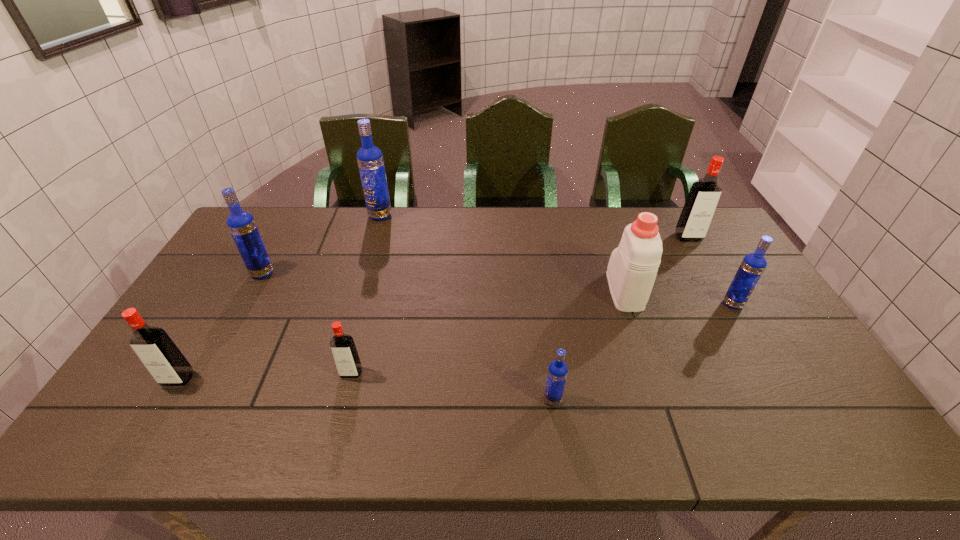
You are a GUI agent. You are given a task and a screenshot of the screen. Output one action in this format:
    pyautogui.click(x=<x>, y=<y>)
    Task: Click on the leftmost red vodka
    The height and width of the screenshot is (540, 960).
    Given the screenshot: What is the action you would take?
    pyautogui.click(x=168, y=366)

Locate an element on the screen. This screenshot has height=540, width=960. the third vodka from right to left is located at coordinates (x=557, y=372).

Find the location of a particular element. Image resolution: width=960 pixels, height=540 pixels. the nearest object is located at coordinates (557, 372).

Where is `the second red vodka from right to left`? Image resolution: width=960 pixels, height=540 pixels. the second red vodka from right to left is located at coordinates (345, 355).

Locate an element on the screen. Image resolution: width=960 pixels, height=540 pixels. vacant space located on the left of the tallest vodka is located at coordinates (320, 215).

Locate an element on the screen. The image size is (960, 540). free space located 0.080m on the back of the fifth nearest vodka is located at coordinates (275, 251).

At what (x,y) coordinates should I click in order to perform the action: click on free space located 0.080m on the front and back of the biggest red vodka. Please return your answer as a coordinate pair (x, y). The height and width of the screenshot is (540, 960). Looking at the image, I should click on (701, 258).

I want to click on free space located on the handle side of the sixth object from left to right, so click(x=602, y=225).

Find the location of a particular element. free point located on the handle side of the sixth object from left to right is located at coordinates (601, 224).

At what (x,y) coordinates should I click in order to perform the action: click on vacant space located on the handle side of the sixth object from left to right. Please return your answer as a coordinate pair (x, y). Looking at the image, I should click on (600, 220).